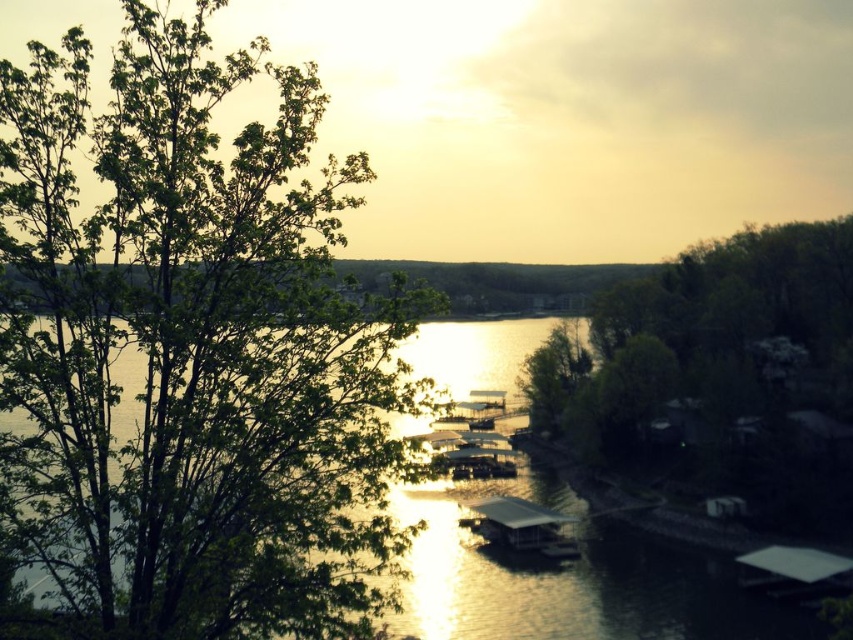
Is point (819, 397) more distant than point (502, 372)?

Yes, point (819, 397) is farther from viewer.

How distant is green leafy tree at center from glistening water at center?

green leafy tree at center and glistening water at center are 3.17 meters apart.

Is point (723, 332) positioned after point (416, 630)?

Yes, it is.

The image size is (853, 640). I want to click on green leafy tree at center, so click(718, 372).

Is point (70, 528) closer to viewer compared to point (647, 628)?

Yes, it is in front of point (647, 628).

Which is behind, point (151, 273) or point (727, 627)?

Point (727, 627)

This screenshot has height=640, width=853. What do you see at coordinates (192, 353) in the screenshot? I see `green leafy tree at left` at bounding box center [192, 353].

The height and width of the screenshot is (640, 853). Identify the location of green leafy tree at left. (192, 353).

Is green leafy tree at left shorter than green leafy tree at center?

Correct, green leafy tree at left is not as tall as green leafy tree at center.

Which is above, green leafy tree at left or green leafy tree at center?

green leafy tree at left

Is point (13, 356) closer to camera compared to point (734, 387)?

Yes, it is in front of point (734, 387).

I want to click on green leafy tree at left, so click(192, 353).